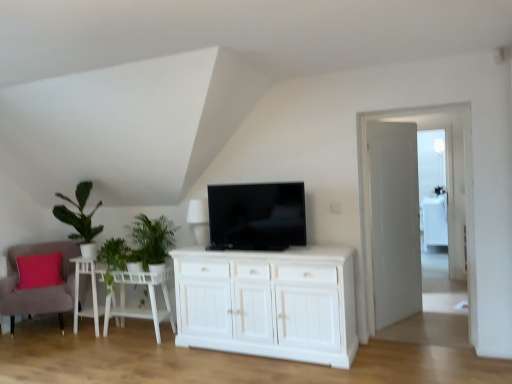
Question: Is velvet pink armchair at lower left bigger than green leafy plant at left, positioned as the 2th plant in right-to-left order?

Choices:
 (A) no
 (B) yes

Answer: (B)

Question: Is velvet pink armchair at lower left shorter than green leafy plant at left, positioned as the 2th plant in right-to-left order?

Choices:
 (A) no
 (B) yes

Answer: (A)

Question: From a real-world perspective, is velvet pink armchair at lower left on green leafy plant at left, positioned as the 2th plant in right-to-left order?

Choices:
 (A) yes
 (B) no

Answer: (B)

Question: Is velvet pink armchair at lower left oriented away from green leafy plant at left, positioned as the 2th plant in right-to-left order?

Choices:
 (A) no
 (B) yes

Answer: (A)

Question: Considering the relative sizes of velvet pink armchair at lower left and green leafy plant at left, positioned as the 2th plant in right-to-left order, in the image provided, is velvet pink armchair at lower left smaller than green leafy plant at left, positioned as the 2th plant in right-to-left order,?

Choices:
 (A) no
 (B) yes

Answer: (A)

Question: Do you think black glossy tv at center is within velvet pink armchair at lower left, or outside of it?

Choices:
 (A) inside
 (B) outside

Answer: (B)

Question: Does point tap(256, 198) appear closer or farther from the camera than point tap(37, 294)?

Choices:
 (A) farther
 (B) closer

Answer: (B)

Question: In terms of height, does black glossy tv at center look taller or shorter compared to velvet pink armchair at lower left?

Choices:
 (A) tall
 (B) short

Answer: (B)

Question: From a real-world perspective, is black glossy tv at center positioned above or below velvet pink armchair at lower left?

Choices:
 (A) above
 (B) below

Answer: (A)

Question: Considering the positions of velvet pink armchair at lower left and white wood side table at lower left in the image, is velvet pink armchair at lower left taller or shorter than white wood side table at lower left?

Choices:
 (A) tall
 (B) short

Answer: (A)

Question: In terms of width, does velvet pink armchair at lower left look wider or thinner when compared to white wood side table at lower left?

Choices:
 (A) thin
 (B) wide

Answer: (B)

Question: From the image's perspective, relative to white wood side table at lower left, is velvet pink armchair at lower left above or below?

Choices:
 (A) below
 (B) above

Answer: (B)

Question: In the image, is velvet pink armchair at lower left positioned in front of or behind white wood side table at lower left?

Choices:
 (A) behind
 (B) front

Answer: (B)

Question: From a real-world perspective, is green leafy plant at left, positioned as the 2th plant in right-to-left order, positioned above or below white wooden door at right?

Choices:
 (A) below
 (B) above

Answer: (A)

Question: Is green leafy plant at left, positioned as the 2th plant in right-to-left order, in front of or behind white wooden door at right in the image?

Choices:
 (A) behind
 (B) front

Answer: (A)